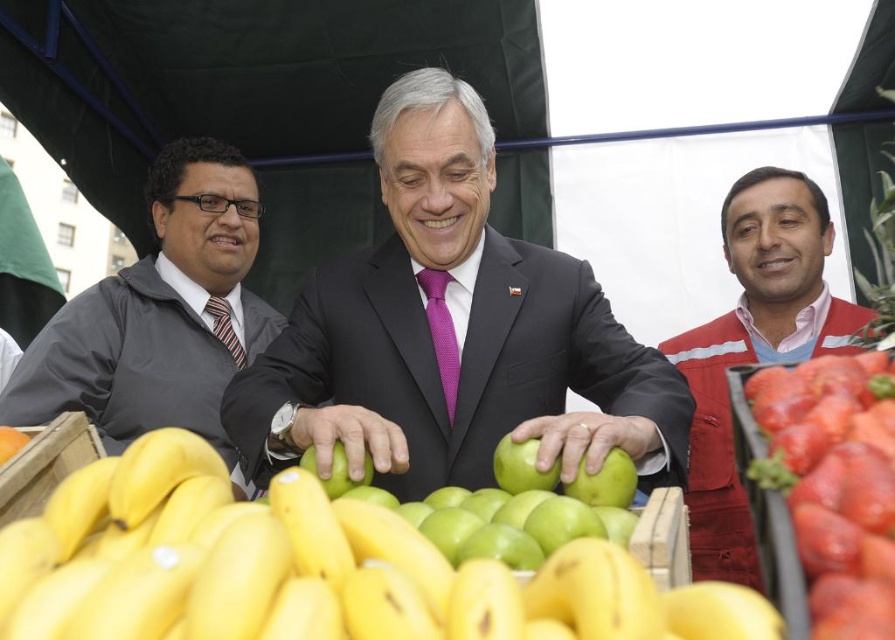
Question: Which object is farther from the camera taking this photo?

Choices:
 (A) red glossy strawberries at lower right
 (B) red fabric vest at right
 (C) gray fabric jacket at left

Answer: (B)

Question: Can you confirm if matte black suit at center is thinner than red fabric vest at right?

Choices:
 (A) yes
 (B) no

Answer: (B)

Question: Is yellow matte bananas at center positioned in front of matte black suit at center?

Choices:
 (A) yes
 (B) no

Answer: (A)

Question: Is yellow matte bananas at center positioned before gray fabric jacket at left?

Choices:
 (A) yes
 (B) no

Answer: (A)

Question: Which object appears farthest from the camera in this image?

Choices:
 (A) green matte apple at center
 (B) yellow matte bananas at center

Answer: (A)

Question: Which point is closer to the camera?

Choices:
 (A) (781, 356)
 (B) (337, 458)
 (C) (167, 180)
 (D) (676, 372)

Answer: (B)